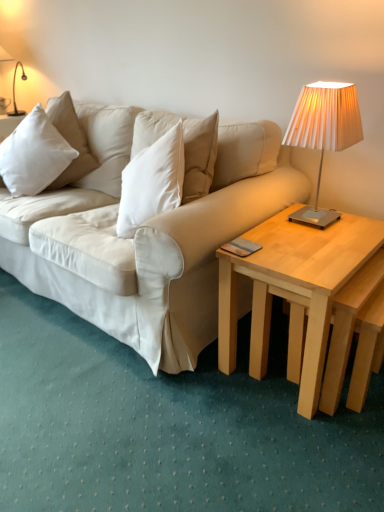
You are a GUI agent. You are given a task and a screenshot of the screen. Output one action in this format:
    pyautogui.click(x=<x>, y=<y>)
    Task: Click on the free location in front of metallic pleated lampshade at upper right
    This screenshot has height=512, width=384.
    Given the screenshot: What is the action you would take?
    pyautogui.click(x=330, y=243)